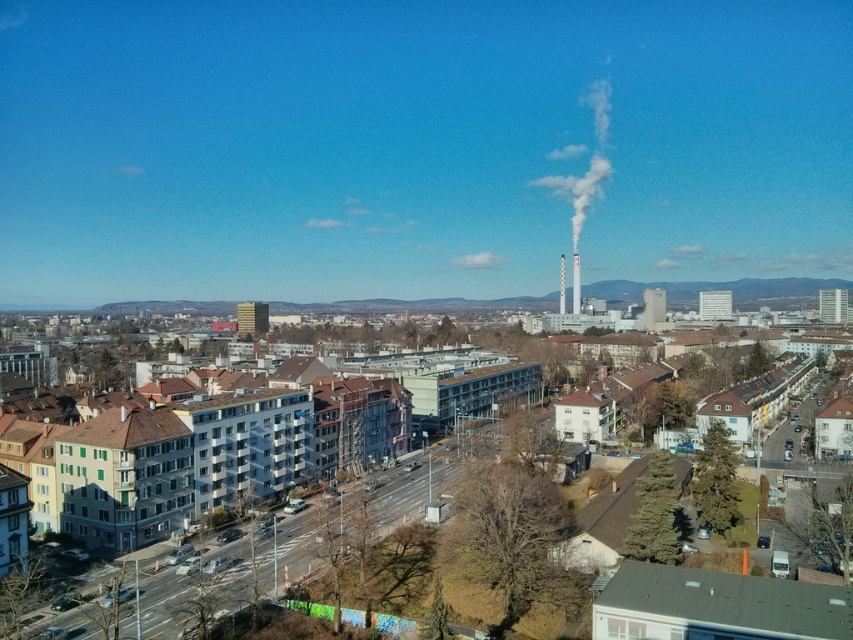
Is white smoke at upper center shorter than smooth gray chimney at center-right?

No, white smoke at upper center is not shorter than smooth gray chimney at center-right.

Who is more forward, (561, 188) or (579, 310)?

Point (579, 310) is more forward.

Find the location of a particular element. white smoke at upper center is located at coordinates (587, 164).